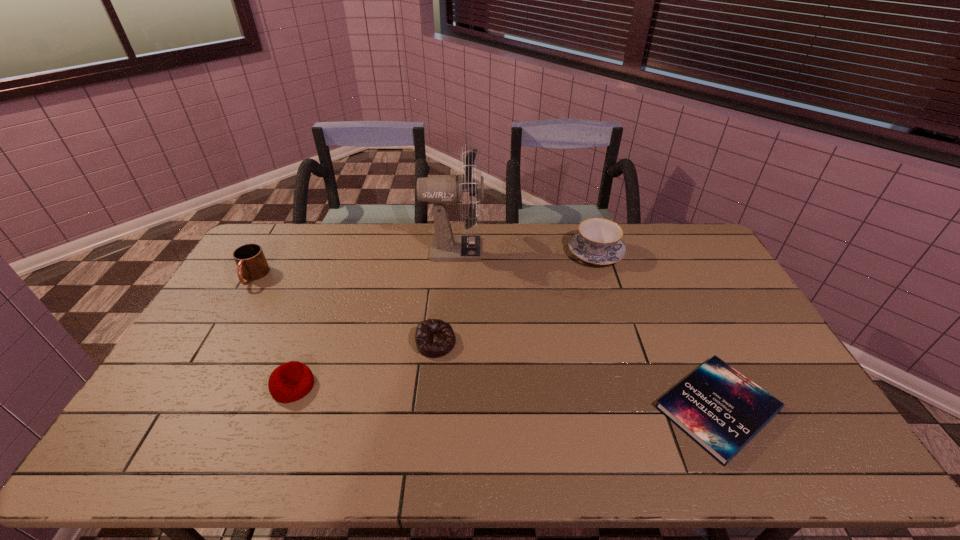
Locate an element on the screen. The image size is (960, 540). fan is located at coordinates (445, 246).

Image resolution: width=960 pixels, height=540 pixels. I want to click on chinaware, so 598,241.

Locate an element on the screen. The width and height of the screenshot is (960, 540). mug is located at coordinates (252, 265).

Image resolution: width=960 pixels, height=540 pixels. What are the coordinates of `the nearer beanbag` in the screenshot? It's located at (291, 381).

At what (x,y) coordinates should I click in order to perform the action: click on the left beanbag. Please return your answer as a coordinate pair (x, y). Looking at the image, I should click on (291, 381).

Identify the location of the shorter beanbag. (434, 338).

This screenshot has width=960, height=540. Identify the location of the right beanbag. (434, 338).

What are the coordinates of `hardback book` in the screenshot? It's located at (718, 407).

Identify the location of vacant space situated 0.370m on the air flow direction of the tallest object. The height and width of the screenshot is (540, 960). coord(583,249).

Identify the location of vacant space located with the handle on the side of the chinaware. (588, 228).